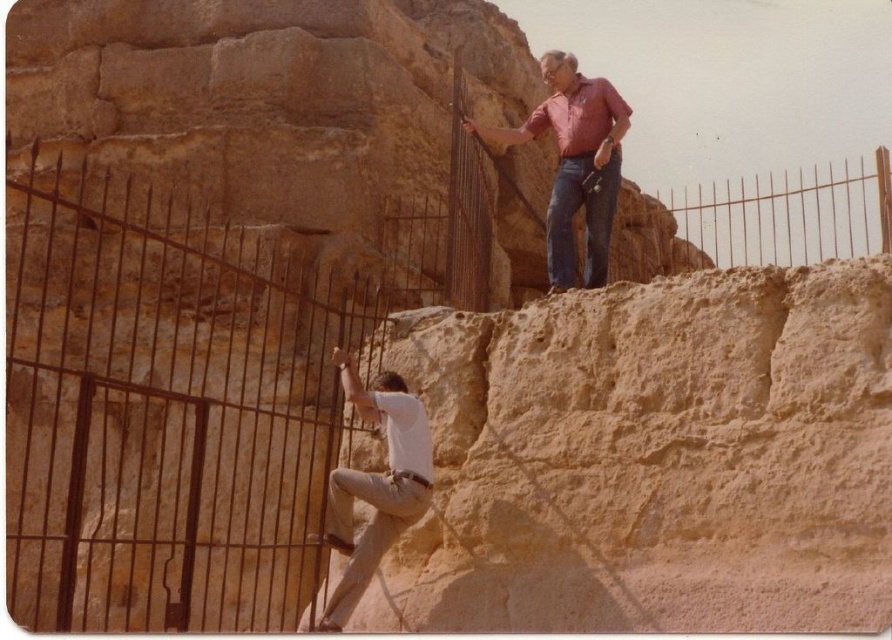
Question: Can you confirm if rusty metal fence at left is positioned to the left of matte red shirt at upper right?

Choices:
 (A) no
 (B) yes

Answer: (B)

Question: Which point is closer to the camera?

Choices:
 (A) (362, 388)
 (B) (574, 170)

Answer: (A)

Question: Is rusty metal fence at left in front of brown metal fence at upper right?

Choices:
 (A) no
 (B) yes

Answer: (B)

Question: Among these objects, which one is nearest to the camera?

Choices:
 (A) matte red shirt at upper right
 (B) white cotton shirt at center

Answer: (B)

Question: Is rusty metal fence at left positioned behind blue denim jeans at upper center?

Choices:
 (A) yes
 (B) no

Answer: (B)

Question: Which of the following is the farthest from the observer?

Choices:
 (A) blue denim jeans at upper center
 (B) rusty metal fence at left
 (C) brown metal fence at upper right
 (D) white cotton shirt at center

Answer: (A)